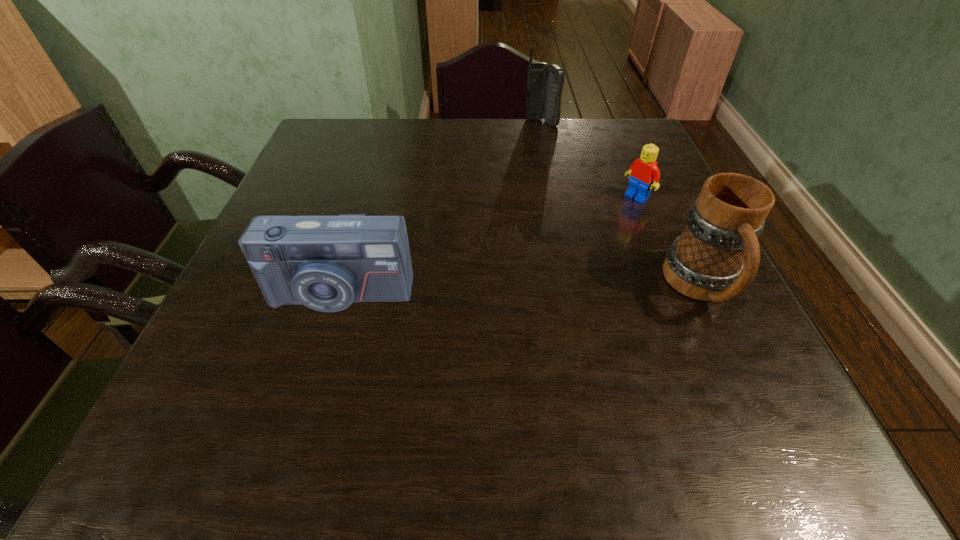
The height and width of the screenshot is (540, 960). In the image, there is a desktop. What are the coordinates of `vacant space at the left edge` in the screenshot? It's located at 348,191.

The image size is (960, 540). What are the coordinates of `vacant space at the far left corner of the desktop` in the screenshot? It's located at (317, 129).

Locate an element on the screen. vacant space at the near left corner of the desktop is located at coordinates (246, 382).

Find the location of a particular element. Image resolution: width=960 pixels, height=540 pixels. vacant point located between the Lego and the third object from right to left is located at coordinates (589, 160).

Locate an element on the screen. This screenshot has height=540, width=960. free spot between the shortest object and the mug is located at coordinates (669, 242).

Locate an element on the screen. The image size is (960, 540). free space between the shortest object and the second object from left to right is located at coordinates (589, 160).

At what (x,y) coordinates should I click in order to perform the action: click on vacant area that lies between the Lego and the cellular telephone. Please return your answer as a coordinate pair (x, y). Looking at the image, I should click on [589, 160].

I want to click on free space between the leftmost object and the Lego, so click(x=488, y=245).

Where is `free space between the shortest object and the third object from right to left`? free space between the shortest object and the third object from right to left is located at coordinates (589, 160).

Identify the location of empty location between the mug and the Lego. The width and height of the screenshot is (960, 540). (669, 242).